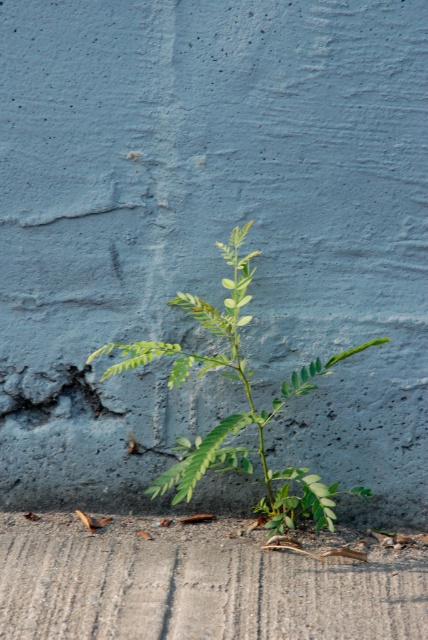
You are a gardener assessing the space in the image. You need to determine if there is enough room to plant another small shrub next to the gray concrete at bottom and the green leafy plant at center. Can you confirm if there is sufficient space?

The gray concrete at bottom occupies less space than the green leafy plant at center, so there might be limited space available. However, since the plant is described as small and sparse, there could be enough room for another small shrub next to them.

You are standing in front of the plant and want to place a small watering can on the gray concrete at bottom. If the watering can requires a minimum of 2 meters of space to avoid tipping over, will it be safe to place it there?

The distance of gray concrete at bottom from viewer is 1.96 meters, which is less than the required 2 meters. Therefore, placing the watering can there may cause it to tip over.

You are standing in front of the textured wall and see the gray concrete at bottom and the green leafy plant at center. Which object is closer to you?

The gray concrete at bottom is closer to the viewer than the green leafy plant at center.